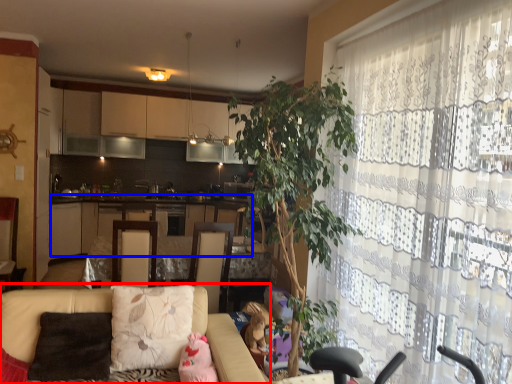
Question: Which object is further to the camera taking this photo, studio couch (highlighted by a red box) or cabinetry (highlighted by a blue box)?

Choices:
 (A) studio couch
 (B) cabinetry

Answer: (B)